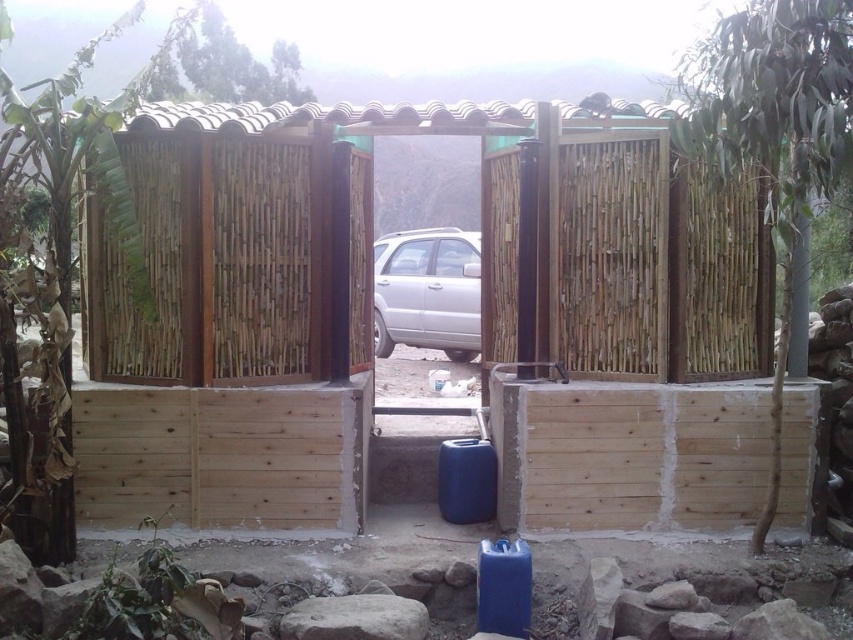
Which is more to the right, natural wood fence at center or satin silver car at center?

natural wood fence at center

Can you confirm if natural wood fence at center is positioned to the left of satin silver car at center?

In fact, natural wood fence at center is to the right of satin silver car at center.

Does point (277, 250) lie behind point (374, 317)?

No, it is not.

At what (x,y) coordinates should I click in order to perform the action: click on natural wood fence at center. Please return your answer as a coordinate pair (x, y). The width and height of the screenshot is (853, 640). Looking at the image, I should click on (480, 323).